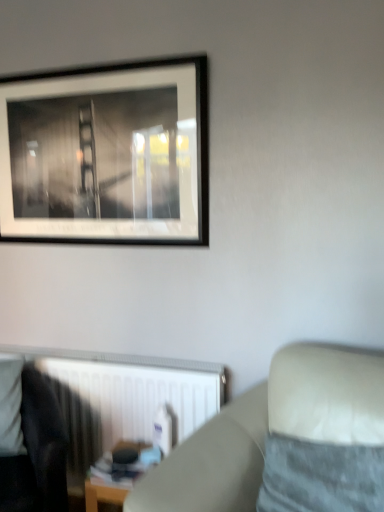
Question: From a real-world perspective, is black matte picture frame at upper left on top of velvety gray pillow at lower right?

Choices:
 (A) yes
 (B) no

Answer: (A)

Question: Is the depth of black matte picture frame at upper left greater than that of velvety gray pillow at lower right?

Choices:
 (A) yes
 (B) no

Answer: (A)

Question: Is black matte picture frame at upper left shorter than velvety gray pillow at lower right?

Choices:
 (A) no
 (B) yes

Answer: (A)

Question: Would you say velvety gray pillow at lower right is part of black matte picture frame at upper left's contents?

Choices:
 (A) no
 (B) yes

Answer: (A)

Question: Is black matte picture frame at upper left thinner than velvety gray pillow at lower right?

Choices:
 (A) no
 (B) yes

Answer: (B)

Question: From the image's perspective, relative to black matte picture frame at upper left, is dark fabric rocking chair at lower left above or below?

Choices:
 (A) above
 (B) below

Answer: (B)

Question: In terms of height, does dark fabric rocking chair at lower left look taller or shorter compared to black matte picture frame at upper left?

Choices:
 (A) tall
 (B) short

Answer: (B)

Question: Is dark fabric rocking chair at lower left wider or thinner than black matte picture frame at upper left?

Choices:
 (A) wide
 (B) thin

Answer: (A)

Question: From a real-world perspective, is dark fabric rocking chair at lower left above or below black matte picture frame at upper left?

Choices:
 (A) below
 (B) above

Answer: (A)

Question: From the image's perspective, relative to wooden table at lower center, is dark fabric rocking chair at lower left above or below?

Choices:
 (A) below
 (B) above

Answer: (B)

Question: Is dark fabric rocking chair at lower left wider or thinner than wooden table at lower center?

Choices:
 (A) thin
 (B) wide

Answer: (B)

Question: Is dark fabric rocking chair at lower left inside the boundaries of wooden table at lower center, or outside?

Choices:
 (A) outside
 (B) inside

Answer: (A)

Question: From a real-world perspective, relative to wooden table at lower center, is dark fabric rocking chair at lower left vertically above or below?

Choices:
 (A) above
 (B) below

Answer: (A)

Question: Considering the relative positions of beige fabric couch at lower right and black matte picture frame at upper left in the image provided, is beige fabric couch at lower right to the left or to the right of black matte picture frame at upper left?

Choices:
 (A) left
 (B) right

Answer: (B)

Question: From a real-world perspective, relative to black matte picture frame at upper left, is beige fabric couch at lower right vertically above or below?

Choices:
 (A) above
 (B) below

Answer: (B)